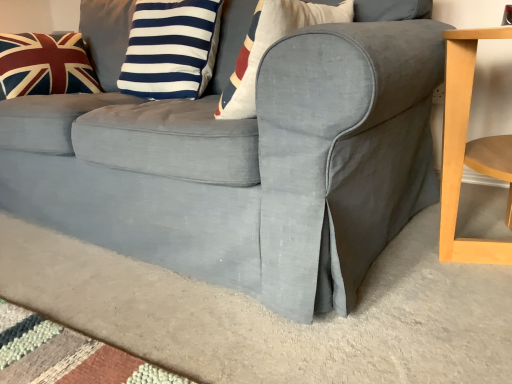
Question: Looking at their shapes, would you say blue/white striped pillow at upper center, the 2th pillow in the left-to-right sequence, is wider or thinner than union jack fabric pillow at upper left, which ranks as the 1th pillow in left-to-right order?

Choices:
 (A) wide
 (B) thin

Answer: (B)

Question: From the image's perspective, is blue/white striped pillow at upper center, acting as the 1th pillow starting from the right, positioned above or below union jack fabric pillow at upper left, the 2th pillow when ordered from right to left?

Choices:
 (A) below
 (B) above

Answer: (A)

Question: Is blue/white striped pillow at upper center, acting as the 1th pillow starting from the right, situated inside union jack fabric pillow at upper left, the 2th pillow when ordered from right to left, or outside?

Choices:
 (A) outside
 (B) inside

Answer: (A)

Question: In terms of width, does union jack fabric pillow at upper left, the 2th pillow when ordered from right to left, look wider or thinner when compared to blue/white striped pillow at upper center, the 2th pillow in the left-to-right sequence?

Choices:
 (A) thin
 (B) wide

Answer: (B)

Question: Visually, is union jack fabric pillow at upper left, which ranks as the 1th pillow in left-to-right order, positioned to the left or to the right of blue/white striped pillow at upper center, acting as the 1th pillow starting from the right?

Choices:
 (A) right
 (B) left

Answer: (B)

Question: From the image's perspective, is union jack fabric pillow at upper left, which ranks as the 1th pillow in left-to-right order, positioned above or below blue/white striped pillow at upper center, the 2th pillow in the left-to-right sequence?

Choices:
 (A) above
 (B) below

Answer: (A)

Question: Choose the correct answer: Is union jack fabric pillow at upper left, the 2th pillow when ordered from right to left, inside blue/white striped pillow at upper center, the 2th pillow in the left-to-right sequence, or outside it?

Choices:
 (A) outside
 (B) inside

Answer: (A)